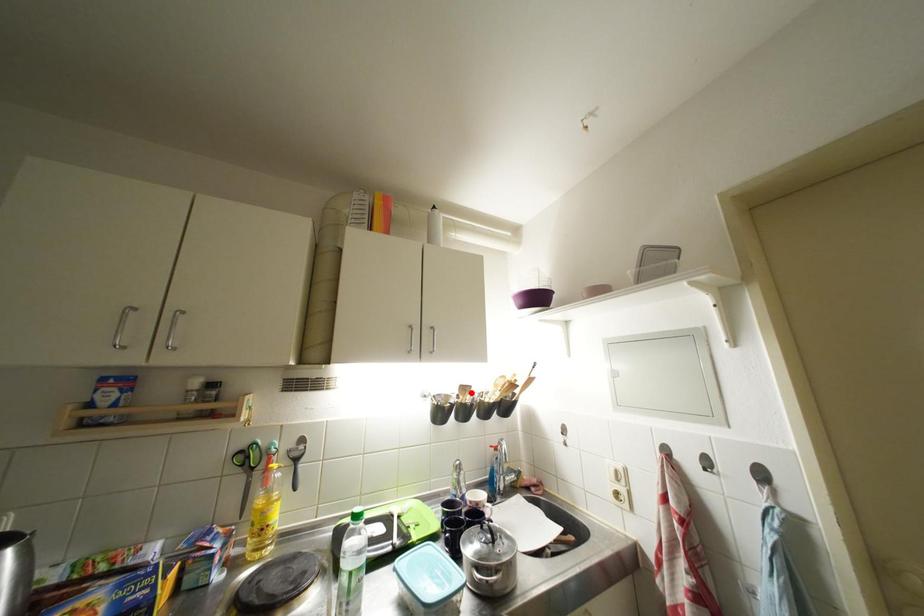
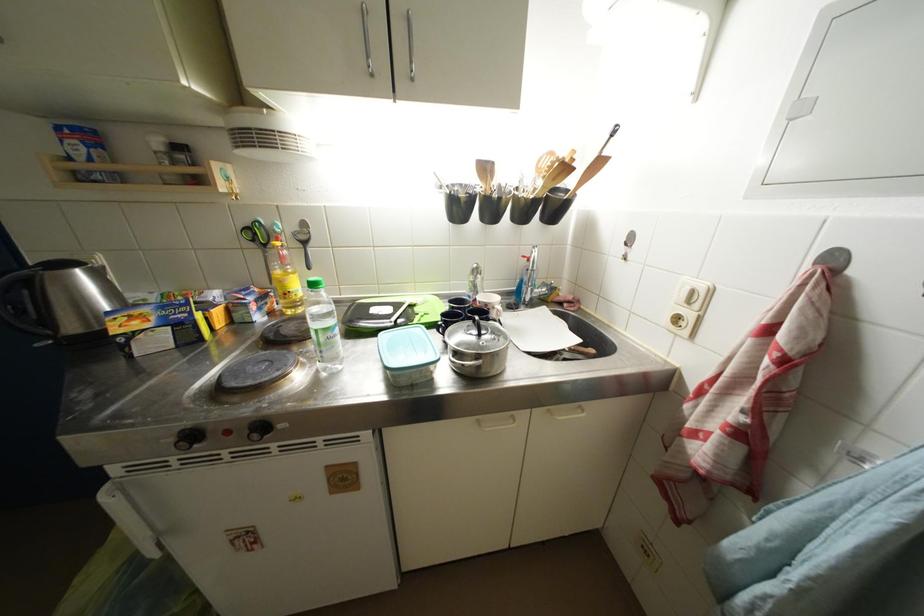
Find the pixel in the second image that matches the highlighted location in the first image.

(492, 172)